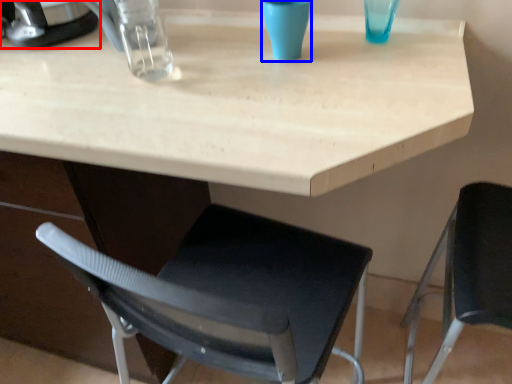
Question: Which object appears closest to the camera in this image, appliance (highlighted by a red box) or clear (highlighted by a blue box)?

Choices:
 (A) appliance
 (B) clear

Answer: (B)